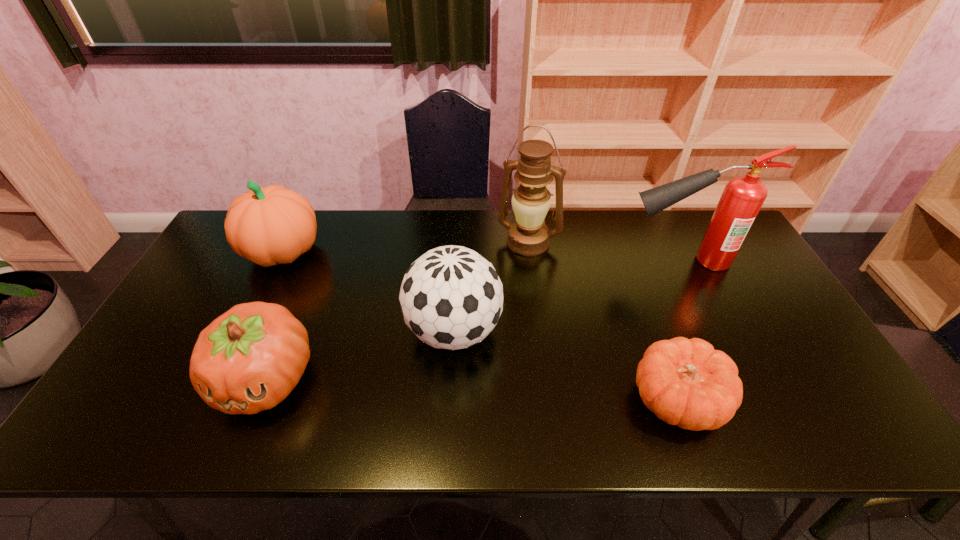
What are the coordinates of `object that is at the far right corner` in the screenshot? It's located at (743, 196).

The image size is (960, 540). What are the coordinates of `vacant region at the far edge of the desktop` in the screenshot? It's located at (665, 218).

In the image, there is a desktop. Identify the location of free space at the near edge. (642, 441).

I want to click on vacant region at the right edge of the desktop, so click(x=738, y=268).

The width and height of the screenshot is (960, 540). What are the coordinates of `free space at the far left corner of the desktop` in the screenshot? It's located at (219, 253).

Locate an element on the screen. This screenshot has height=540, width=960. vacant space at the near right corner of the desktop is located at coordinates (839, 425).

Find the location of a particular element. This screenshot has width=960, height=540. free space that is in between the shortest object and the second shortest object is located at coordinates (471, 390).

The image size is (960, 540). What are the coordinates of `free space between the fifth tallest object and the soccer ball` in the screenshot? It's located at (360, 355).

Find the location of a particular element. blank region between the soccer ball and the shortest pumpkin is located at coordinates (565, 366).

Where is `unoccupied area between the oil lamp and the second tallest pumpkin`? unoccupied area between the oil lamp and the second tallest pumpkin is located at coordinates (397, 310).